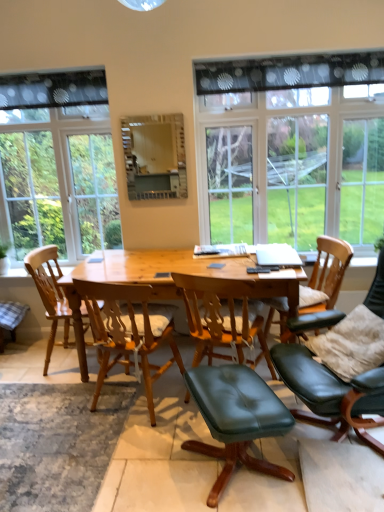
Question: Do you think natural wood table at center is within black leather chair at right, the 1th chair in the right-to-left sequence, or outside of it?

Choices:
 (A) outside
 (B) inside

Answer: (A)

Question: Relative to black leather chair at right, the 1th chair in the right-to-left sequence, is natural wood table at center in front or behind?

Choices:
 (A) front
 (B) behind

Answer: (B)

Question: Considering the real-world distances, which object is farthest from the wooden chair at left, which is the 4th chair in right-to-left order?

Choices:
 (A) natural wood table at center
 (B) black leather chair at right, the 1th chair in the right-to-left sequence
 (C) leather cushioned chair at center, which ranks as the 2th chair in right-to-left order
 (D) clear glass window at left, placed as the second window when sorted from right to left
 (E) black dotted fabric at upper left

Answer: (B)

Question: Estimate the real-world distances between objects in this image. Which object is farther from the green leather stool at lower center?

Choices:
 (A) black dotted fabric at upper left
 (B) wooden chair at center, the third chair in the right-to-left sequence
 (C) clear glass window at left, placed as the second window when sorted from right to left
 (D) leather cushioned chair at center, which ranks as the 2th chair in right-to-left order
 (E) transparent glass window at upper center, which is the 2th window from left to right

Answer: (A)